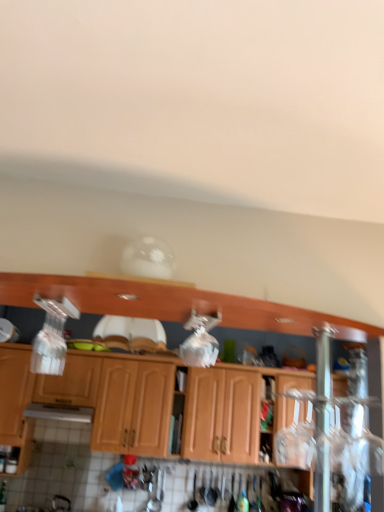
Question: From a real-world perspective, is wooden cabinets at center, the first cabinetry in the front-to-back sequence, physically below wooden cabinet at center, the 1th cabinetry positioned from the back?

Choices:
 (A) no
 (B) yes

Answer: (A)

Question: Is wooden cabinets at center, placed as the 3th cabinetry when sorted from back to front, in contact with wooden cabinet at center, the 3th cabinetry positioned from the front?

Choices:
 (A) yes
 (B) no

Answer: (B)

Question: Considering the relative sizes of wooden cabinets at center, the first cabinetry in the front-to-back sequence, and wooden cabinet at center, the 3th cabinetry positioned from the front, in the image provided, is wooden cabinets at center, the first cabinetry in the front-to-back sequence, shorter than wooden cabinet at center, the 3th cabinetry positioned from the front,?

Choices:
 (A) yes
 (B) no

Answer: (A)

Question: Can you confirm if wooden cabinets at center, the first cabinetry in the front-to-back sequence, is thinner than wooden cabinet at center, the 3th cabinetry positioned from the front?

Choices:
 (A) no
 (B) yes

Answer: (A)

Question: Is wooden cabinets at center, the first cabinetry in the front-to-back sequence, located outside wooden cabinet at center, the 3th cabinetry positioned from the front?

Choices:
 (A) no
 (B) yes

Answer: (B)

Question: Does wooden cabinets at center, the first cabinetry in the front-to-back sequence, appear on the left side of wooden cabinet at center, the 3th cabinetry positioned from the front?

Choices:
 (A) yes
 (B) no

Answer: (A)

Question: From a real-world perspective, is wooden cabinet at center, which is counted as the second cabinetry, starting from the back, on wooden cabinets at center, placed as the 3th cabinetry when sorted from back to front?

Choices:
 (A) no
 (B) yes

Answer: (A)

Question: Considering the relative sizes of wooden cabinet at center, the 2th cabinetry positioned from the front, and wooden cabinets at center, the first cabinetry in the front-to-back sequence, in the image provided, is wooden cabinet at center, the 2th cabinetry positioned from the front, shorter than wooden cabinets at center, the first cabinetry in the front-to-back sequence,?

Choices:
 (A) yes
 (B) no

Answer: (B)

Question: Is wooden cabinet at center, the 2th cabinetry positioned from the front, outside of wooden cabinets at center, placed as the 3th cabinetry when sorted from back to front?

Choices:
 (A) no
 (B) yes

Answer: (B)

Question: Can you confirm if wooden cabinet at center, the 2th cabinetry positioned from the front, is wider than wooden cabinets at center, placed as the 3th cabinetry when sorted from back to front?

Choices:
 (A) yes
 (B) no

Answer: (B)

Question: Considering the relative sizes of wooden cabinet at center, which is counted as the second cabinetry, starting from the back, and wooden cabinets at center, the first cabinetry in the front-to-back sequence, in the image provided, is wooden cabinet at center, which is counted as the second cabinetry, starting from the back, bigger than wooden cabinets at center, the first cabinetry in the front-to-back sequence,?

Choices:
 (A) yes
 (B) no

Answer: (A)

Question: Is wooden cabinet at center, the 2th cabinetry positioned from the front, facing away from wooden cabinets at center, the first cabinetry in the front-to-back sequence?

Choices:
 (A) no
 (B) yes

Answer: (A)

Question: Considering the relative sizes of wooden cabinet at center, which is counted as the second cabinetry, starting from the back, and wooden cabinet at center, the 1th cabinetry positioned from the back, in the image provided, is wooden cabinet at center, which is counted as the second cabinetry, starting from the back, bigger than wooden cabinet at center, the 1th cabinetry positioned from the back,?

Choices:
 (A) yes
 (B) no

Answer: (A)